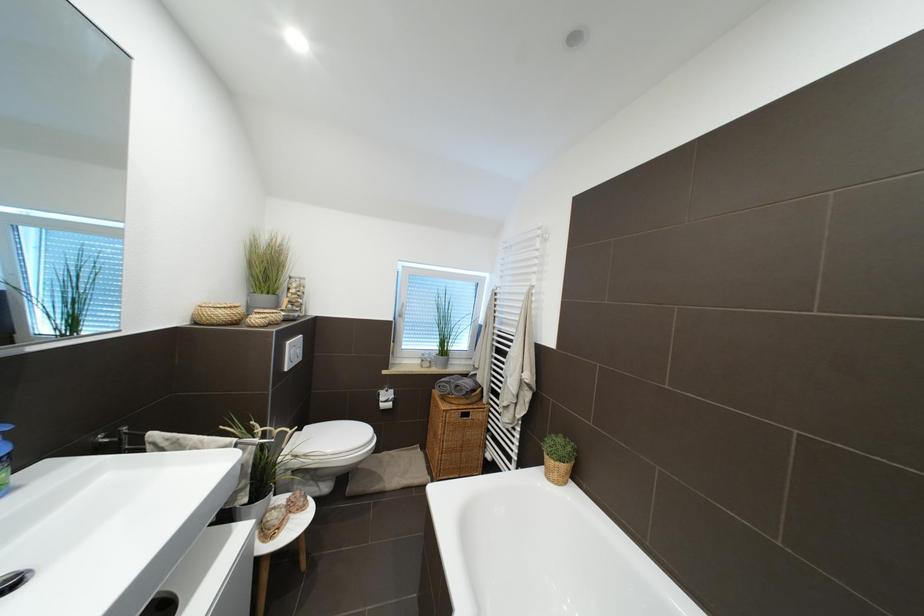
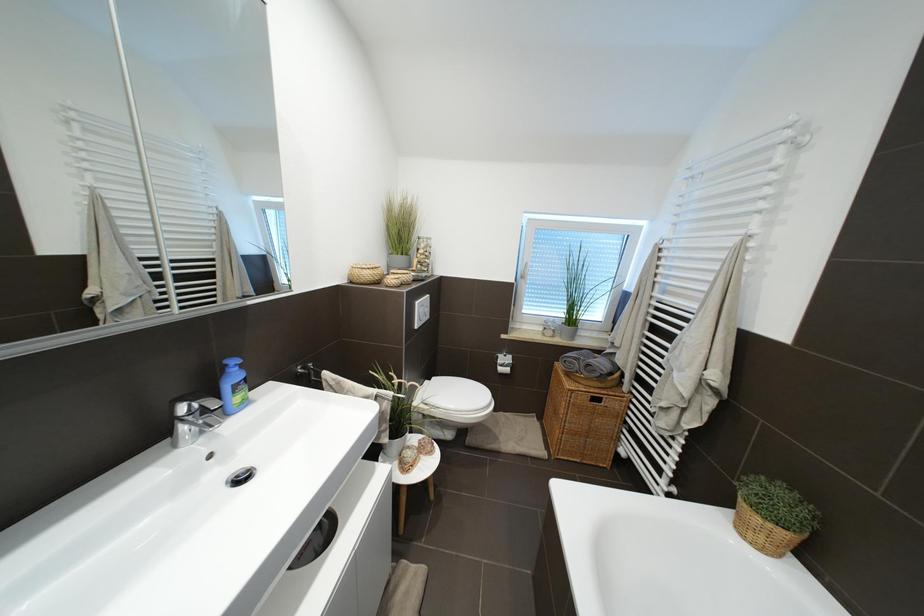
Question: The first image is from the beginning of the video and the second image is from the end. How did the camera likely rotate when shooting the video?

Choices:
 (A) Left
 (B) Right
 (C) Up
 (D) Down

Answer: (A)